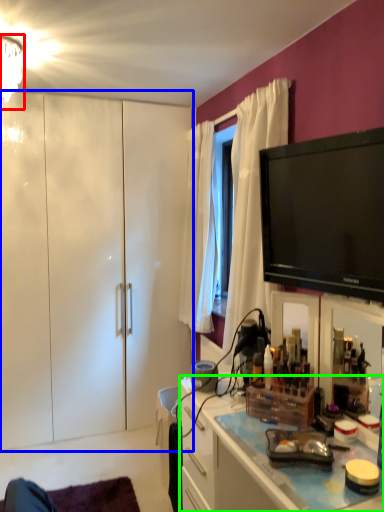
Question: Estimate the real-world distances between objects in this image. Which object is closer to lamp (highlighted by a red box), cabinetry (highlighted by a blue box) or cabinetry (highlighted by a green box)?

Choices:
 (A) cabinetry
 (B) cabinetry

Answer: (A)